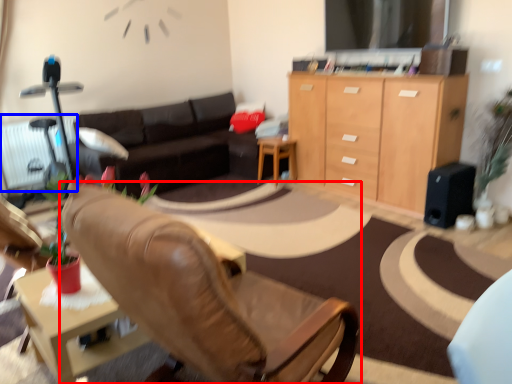
Question: Among these objects, which one is nearest to the camera, chair (highlighted by a red box) or radiator (highlighted by a blue box)?

Choices:
 (A) chair
 (B) radiator

Answer: (A)